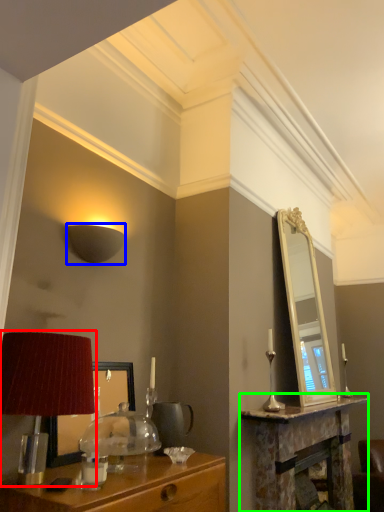
Question: Based on their relative distances, which object is nearer to table lamp (highlighted by a red box)? Choose from lamp (highlighted by a blue box) and table (highlighted by a green box).

Choices:
 (A) lamp
 (B) table

Answer: (A)